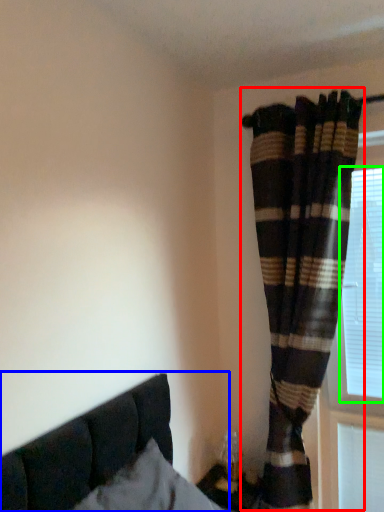
Question: Which is farther away from curtain (highlighted by a red box)? bed (highlighted by a blue box) or bay window (highlighted by a green box)?

Choices:
 (A) bed
 (B) bay window

Answer: (A)